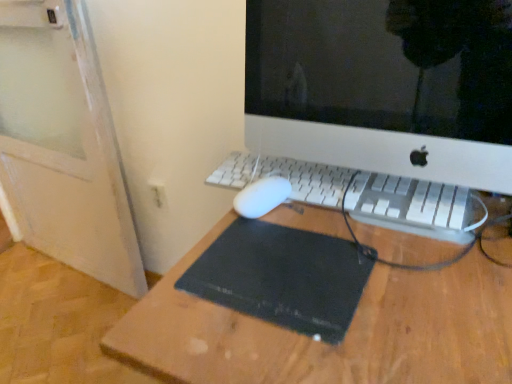
Describe the element at coordinates (385, 85) in the screenshot. I see `white plastic computer monitor at center` at that location.

Find the location of a particular element. The height and width of the screenshot is (384, 512). white plastic computer monitor at center is located at coordinates (385, 85).

From a real-world perspective, is black rubber mousepad at center on white plastic computer monitor at center?

No, from a real-world perspective, black rubber mousepad at center is not on top of white plastic computer monitor at center.

Who is smaller, black rubber mousepad at center or white plastic computer monitor at center?

With smaller size is black rubber mousepad at center.

Does black rubber mousepad at center have a lesser height compared to white plastic computer monitor at center?

Correct, black rubber mousepad at center is not as tall as white plastic computer monitor at center.

Is black rubber mousepad at center positioned beyond the bounds of white plastic computer monitor at center?

black rubber mousepad at center is positioned outside white plastic computer monitor at center.

Considering the relative positions of white plastic electric outlet at lower left and white plastic keyboard at center in the image provided, is white plastic electric outlet at lower left to the left or to the right of white plastic keyboard at center?

Clearly, white plastic electric outlet at lower left is on the left of white plastic keyboard at center in the image.

Is white plastic electric outlet at lower left oriented towards white plastic keyboard at center?

No.

Considering the relative sizes of white plastic electric outlet at lower left and white plastic keyboard at center in the image provided, is white plastic electric outlet at lower left bigger than white plastic keyboard at center?

Actually, white plastic electric outlet at lower left might be smaller than white plastic keyboard at center.

From the image's perspective, relative to white plastic keyboard at center, is white plastic electric outlet at lower left above or below?

white plastic electric outlet at lower left is below white plastic keyboard at center.

From the image's perspective, which is above, white plastic electric outlet at lower left or black rubber mousepad at center?

From the image's view, white plastic electric outlet at lower left is above.

Find the location of a particular element. The image size is (512, 384). electric outlet below the black rubber mousepad at center (from a real-world perspective) is located at coordinates (157, 192).

Between point (162, 207) and point (265, 254), which one is positioned behind?

The point (162, 207) is farther from the camera.

Is white plastic electric outlet at lower left positioned with its back to black rubber mousepad at center?

No.

From the image's perspective, is white plastic keyboard at center above white plastic electric outlet at lower left?

Correct, white plastic keyboard at center appears higher than white plastic electric outlet at lower left in the image.

Is the position of white plastic keyboard at center less distant than that of white plastic electric outlet at lower left?

That is True.

Can you confirm if white plastic keyboard at center is shorter than white plastic electric outlet at lower left?

Yes.

This screenshot has width=512, height=384. I want to click on computer keyboard positioned vertically above the white plastic electric outlet at lower left (from a real-world perspective), so click(x=410, y=204).

Is the depth of white plastic electric outlet at lower left greater than that of white plastic computer monitor at center?

Yes, it is behind white plastic computer monitor at center.

Which of these two, white plastic electric outlet at lower left or white plastic computer monitor at center, stands shorter?

white plastic electric outlet at lower left is shorter.

Consider the image. Is there a large distance between white plastic electric outlet at lower left and white plastic computer monitor at center?

No.

Is white plastic electric outlet at lower left wider or thinner than white plastic computer monitor at center?

Considering their sizes, white plastic electric outlet at lower left looks slimmer than white plastic computer monitor at center.

Is white plastic computer monitor at center looking in the opposite direction of black rubber mousepad at center?

white plastic computer monitor at center does not have its back to black rubber mousepad at center.

From the image's perspective, between white plastic computer monitor at center and black rubber mousepad at center, which one is located above?

white plastic computer monitor at center, from the image's perspective.

Locate an element on the screen. The height and width of the screenshot is (384, 512). computer monitor to the right of black rubber mousepad at center is located at coordinates (385, 85).

From a real-world perspective, is white plastic computer monitor at center positioned under black rubber mousepad at center based on gravity?

No, from a real-world perspective, white plastic computer monitor at center is not under black rubber mousepad at center.

Between white plastic keyboard at center and white plastic computer monitor at center, which one appears on the left side from the viewer's perspective?

From the viewer's perspective, white plastic keyboard at center appears more on the left side.

Considering the relative sizes of white plastic keyboard at center and white plastic computer monitor at center in the image provided, is white plastic keyboard at center taller than white plastic computer monitor at center?

Incorrect, the height of white plastic keyboard at center is not larger of that of white plastic computer monitor at center.

What are the coordinates of `computer keyboard below the white plastic computer monitor at center (from a real-world perspective)` in the screenshot? It's located at coord(410,204).

Locate an element on the screen. mousepad on the left of white plastic computer monitor at center is located at coordinates (282, 277).

Where is `electric outlet below the white plastic keyboard at center (from a real-world perspective)`? electric outlet below the white plastic keyboard at center (from a real-world perspective) is located at coordinates (157, 192).

Which object lies nearer to the anchor point black rubber mousepad at center, white plastic electric outlet at lower left or white plastic computer monitor at center?

white plastic electric outlet at lower left.

Based on their spatial positions, is white plastic keyboard at center or white plastic computer monitor at center further from white plastic electric outlet at lower left?

white plastic computer monitor at center is positioned further to the anchor white plastic electric outlet at lower left.

Based on their spatial positions, is white plastic keyboard at center or white plastic electric outlet at lower left further from black rubber mousepad at center?

Among the two, white plastic electric outlet at lower left is located further to black rubber mousepad at center.

Estimate the real-world distances between objects in this image. Which object is further from white plastic keyboard at center, white plastic computer monitor at center or white plastic electric outlet at lower left?

white plastic computer monitor at center is positioned further to the anchor white plastic keyboard at center.

From the image, which object appears to be farther from white plastic keyboard at center, black rubber mousepad at center or white plastic computer monitor at center?

Based on the image, white plastic computer monitor at center appears to be further to white plastic keyboard at center.

Considering their positions, is white plastic computer monitor at center positioned further to white plastic keyboard at center than black rubber mousepad at center?

white plastic computer monitor at center is positioned further to the anchor white plastic keyboard at center.

From the image, which object appears to be farther from white plastic keyboard at center, black rubber mousepad at center or white plastic electric outlet at lower left?

white plastic electric outlet at lower left.

Looking at the image, which one is located closer to white plastic computer monitor at center, white plastic keyboard at center or white plastic electric outlet at lower left?

white plastic electric outlet at lower left is closer to white plastic computer monitor at center.

Identify the location of computer keyboard between black rubber mousepad at center and white plastic electric outlet at lower left from front to back. The image size is (512, 384). (410, 204).

The width and height of the screenshot is (512, 384). What are the coordinates of `computer keyboard located between white plastic computer monitor at center and white plastic electric outlet at lower left in the depth direction` in the screenshot? It's located at (410, 204).

Find the location of a particular element. The height and width of the screenshot is (384, 512). mousepad located between white plastic computer monitor at center and white plastic electric outlet at lower left in the depth direction is located at coordinates (282, 277).

Locate an element on the screen. This screenshot has height=384, width=512. computer keyboard between white plastic computer monitor at center and black rubber mousepad at center in the vertical direction is located at coordinates (410, 204).